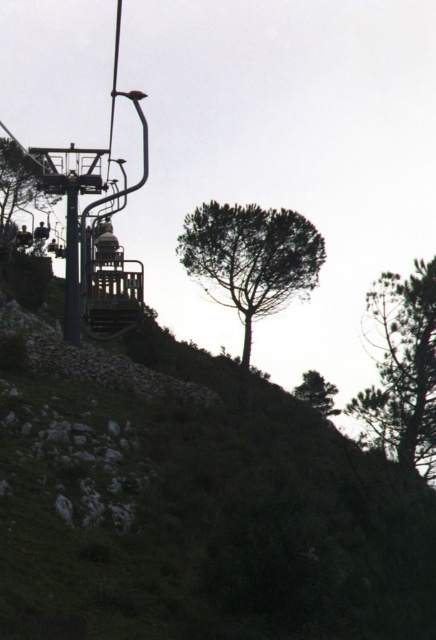
Is green leafy tree at center bigger than green textured tree at upper right?

A: Correct, green leafy tree at center is larger in size than green textured tree at upper right.

Locate an element on the screen. This screenshot has width=436, height=640. green leafy tree at center is located at coordinates (251, 259).

Describe the element at coordinates (251, 259) in the screenshot. The width and height of the screenshot is (436, 640). I see `green leafy tree at center` at that location.

Identify the location of green leafy tree at center. (251, 259).

Is metallic gray ski lift at left bigger than green leafy tree at upper center?

Yes, metallic gray ski lift at left is bigger than green leafy tree at upper center.

Can you confirm if metallic gray ski lift at left is smaller than green leafy tree at upper center?

No.

Who is more forward, (72, 172) or (21, 193)?

Point (72, 172)

The image size is (436, 640). Find the location of `metallic gray ski lift at left`. metallic gray ski lift at left is located at coordinates (82, 193).

Which is in front, point (412, 308) or point (31, 160)?

Point (412, 308) is more forward.

Who is more distant from viewer, (401, 326) or (33, 176)?

The point (33, 176) is behind.

This screenshot has width=436, height=640. I want to click on green textured tree at upper right, so click(402, 369).